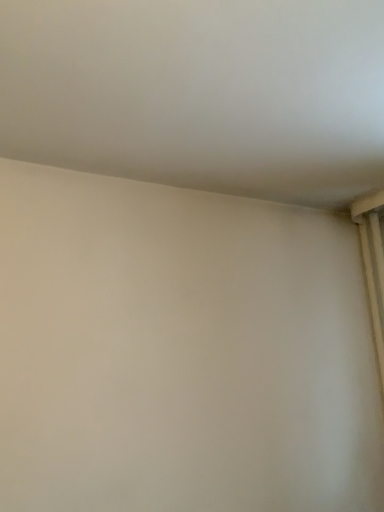
The image size is (384, 512). What do you see at coordinates (373, 264) in the screenshot?
I see `white fabric curtain at right` at bounding box center [373, 264].

Locate an element on the screen. Image resolution: width=384 pixels, height=512 pixels. white fabric curtain at right is located at coordinates (373, 264).

Image resolution: width=384 pixels, height=512 pixels. I want to click on white fabric curtain at right, so click(373, 264).